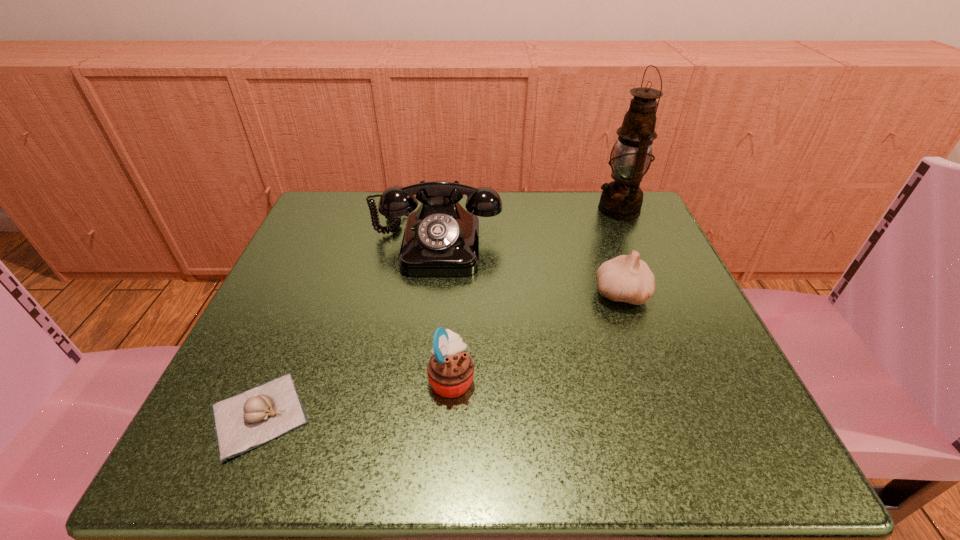
Locate an element on the screen. This screenshot has width=960, height=540. vacant space located on the front of the right garlic is located at coordinates (659, 398).

The height and width of the screenshot is (540, 960). I want to click on vacant space located 0.370m on the back of the shortest object, so click(337, 230).

Where is `oil lamp present at the far edge`? The image size is (960, 540). oil lamp present at the far edge is located at coordinates (622, 199).

At what (x,y) coordinates should I click in order to perform the action: click on telephone positioned at the far edge. Please return your answer as a coordinate pair (x, y). Looking at the image, I should click on (441, 238).

Where is `object that is at the near edge`? This screenshot has height=540, width=960. object that is at the near edge is located at coordinates (242, 422).

You are a GUI agent. You are given a task and a screenshot of the screen. Output one action in this format:
    pyautogui.click(x=<x>, y=<y>)
    Task: Click on the telephone that is at the left edge
    
    Given the screenshot: What is the action you would take?
    pyautogui.click(x=441, y=238)

I want to click on garlic that is at the left edge, so click(x=242, y=422).

This screenshot has height=540, width=960. In order to click on oil lamp that is at the right edge in this screenshot , I will do `click(622, 199)`.

Where is `garlic situated at the right edge`? garlic situated at the right edge is located at coordinates (624, 278).

At what (x,y) coordinates should I click in order to perform the action: click on object located in the far left corner section of the desktop. Please return your answer as a coordinate pair (x, y). Image resolution: width=960 pixels, height=540 pixels. Looking at the image, I should click on (441, 238).